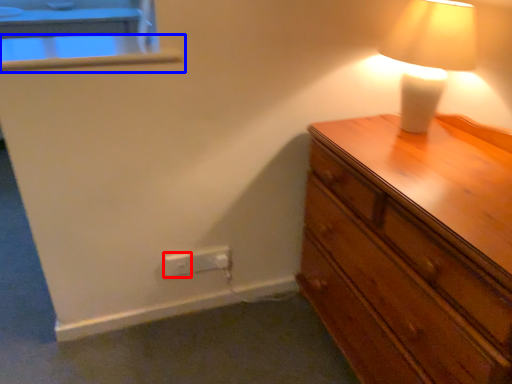
Question: Which point is closer to the camera, electric outlet (highlighted by a red box) or window sill (highlighted by a blue box)?

Choices:
 (A) electric outlet
 (B) window sill

Answer: (B)